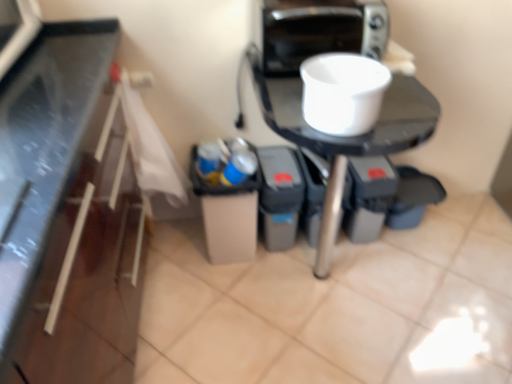
Image resolution: width=512 pixels, height=384 pixels. In order to click on empty space that is to the right of white glossy table at center in this screenshot , I will do `click(446, 277)`.